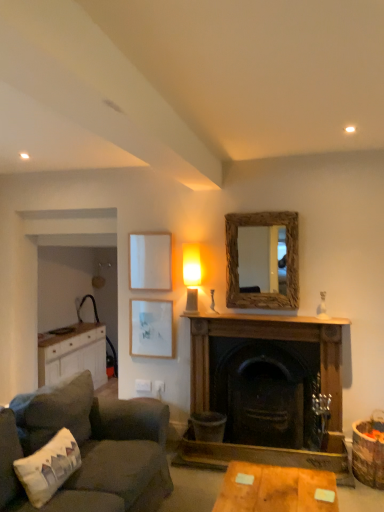
Question: Does rustic wood mirror at upper center lie in front of wooden mantelpiece at center?

Choices:
 (A) no
 (B) yes

Answer: (A)

Question: From a real-world perspective, is rustic wood mirror at upper center positioned under wooden mantelpiece at center based on gravity?

Choices:
 (A) no
 (B) yes

Answer: (A)

Question: Considering the relative sizes of rustic wood mirror at upper center and wooden mantelpiece at center in the image provided, is rustic wood mirror at upper center bigger than wooden mantelpiece at center?

Choices:
 (A) yes
 (B) no

Answer: (A)

Question: Does rustic wood mirror at upper center have a lesser width compared to wooden mantelpiece at center?

Choices:
 (A) no
 (B) yes

Answer: (B)

Question: Does rustic wood mirror at upper center have a greater width compared to wooden mantelpiece at center?

Choices:
 (A) yes
 (B) no

Answer: (B)

Question: From the image's perspective, is wooden fireplace at center positioned above or below white fabric pillow at lower left?

Choices:
 (A) below
 (B) above

Answer: (B)

Question: Is wooden fireplace at center taller or shorter than white fabric pillow at lower left?

Choices:
 (A) short
 (B) tall

Answer: (B)

Question: Would you say wooden fireplace at center is to the left or to the right of white fabric pillow at lower left in the picture?

Choices:
 (A) left
 (B) right

Answer: (B)

Question: Considering the positions of point (198, 359) and point (74, 468), is point (198, 359) closer or farther from the camera than point (74, 468)?

Choices:
 (A) farther
 (B) closer

Answer: (A)

Question: Which is correct: white matte picture frame at upper left, the 2th picture frame ordered from the bottom, is inside wooden table at lower center, or outside of it?

Choices:
 (A) inside
 (B) outside

Answer: (B)

Question: Considering the positions of white matte picture frame at upper left, the 2th picture frame ordered from the bottom, and wooden table at lower center in the image, is white matte picture frame at upper left, the 2th picture frame ordered from the bottom, taller or shorter than wooden table at lower center?

Choices:
 (A) tall
 (B) short

Answer: (A)

Question: From a real-world perspective, relative to wooden table at lower center, is white matte picture frame at upper left, which ranks as the 1th picture frame in top-to-bottom order, vertically above or below?

Choices:
 (A) below
 (B) above

Answer: (B)

Question: Based on their positions, is white matte picture frame at upper left, which ranks as the 1th picture frame in top-to-bottom order, located to the left or right of wooden table at lower center?

Choices:
 (A) left
 (B) right

Answer: (A)

Question: Is point pos(39,381) positioned closer to the camera than point pos(51,458)?

Choices:
 (A) closer
 (B) farther

Answer: (B)

Question: Relative to white fabric pillow at lower left, is white wood cabinet at left in front or behind?

Choices:
 (A) behind
 (B) front

Answer: (A)